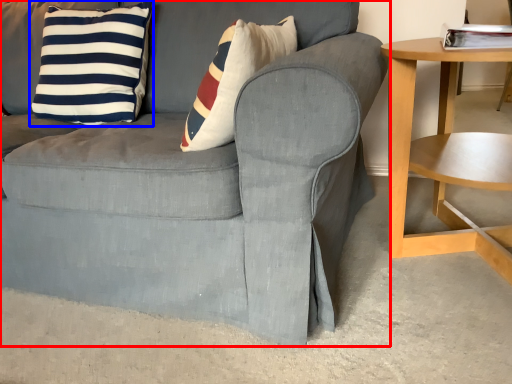
Question: Which of the following is the farthest to the observer, chair (highlighted by a red box) or pillow (highlighted by a blue box)?

Choices:
 (A) chair
 (B) pillow

Answer: (B)